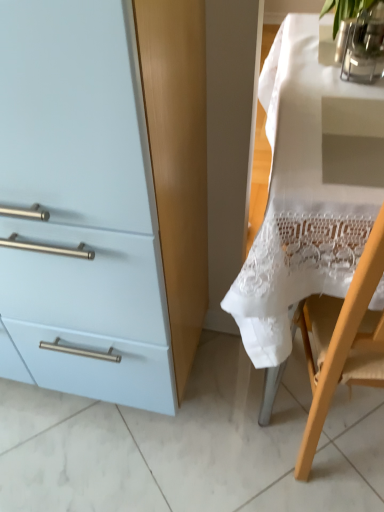
Identify the location of vacant space positioned to the left of clear glass vase at upper right, the second glass vase positioned from the back. (303, 79).